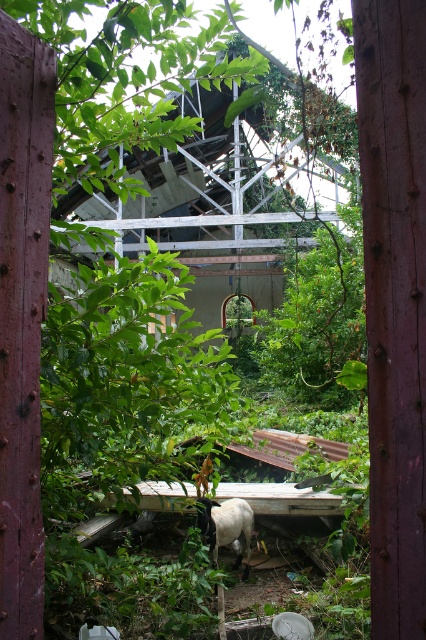
Who is positioned more to the left, concrete structure at center or white woolly sheep at center?

From the viewer's perspective, concrete structure at center appears more on the left side.

Is concrete structure at center to the right of white woolly sheep at center from the viewer's perspective?

No, concrete structure at center is not to the right of white woolly sheep at center.

At what (x,y) coordinates should I click in order to perform the action: click on concrete structure at center. Please return your answer as a coordinate pair (x, y). The width and height of the screenshot is (426, 640). Looking at the image, I should click on (249, 166).